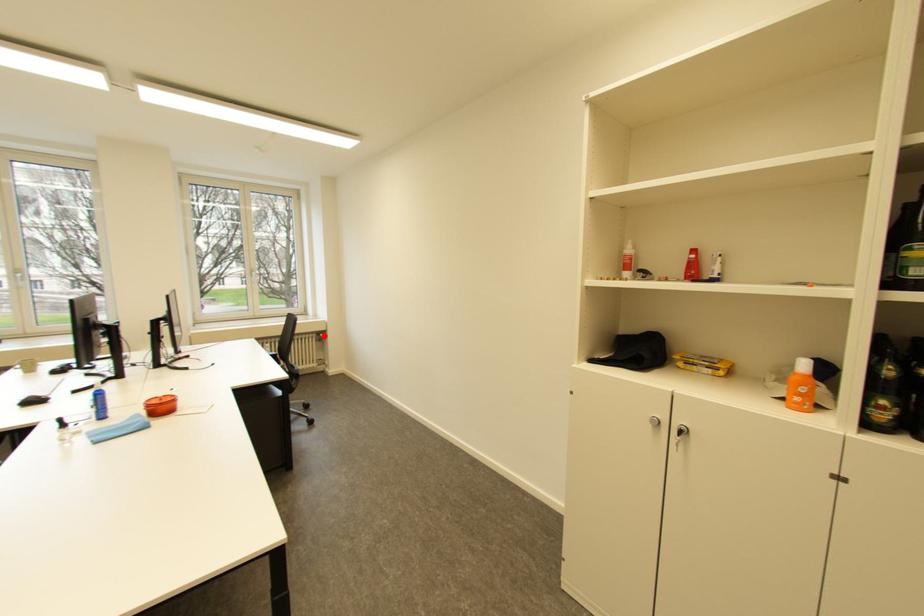
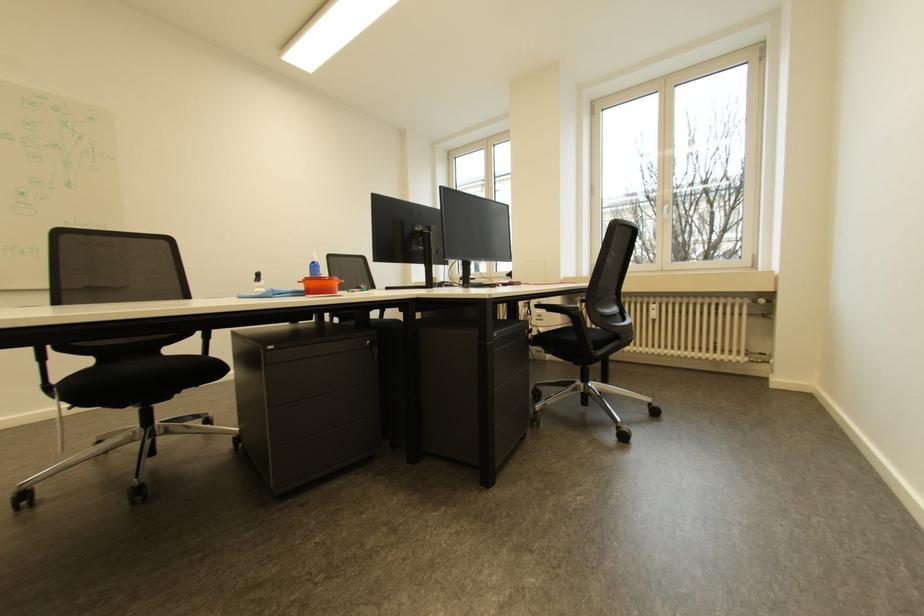
Locate, in the second image, the point that corresponds to the highlighted location in the first image.

(757, 302)